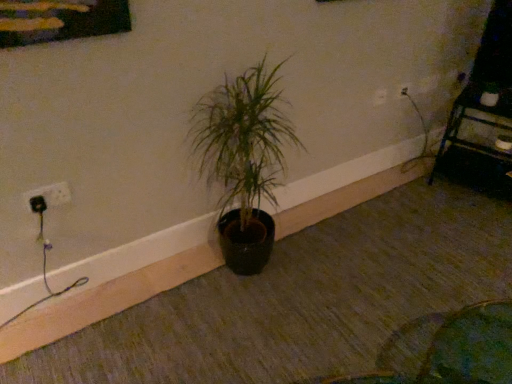
Looking at this image, measure the distance between point (231,143) and camera.

Point (231,143) and camera are 1.71 meters apart.

From the picture: What is the approximate width of green matte plant at center?

green matte plant at center is 37.21 centimeters in width.

This screenshot has height=384, width=512. What are the coordinates of `green matte plant at center` in the screenshot? It's located at (243, 160).

Based on the photo, is white plastic electric outlet at upper right, acting as the second electric outlet starting from the front, turned away from green matte plant at center?

No, white plastic electric outlet at upper right, acting as the second electric outlet starting from the front,'s orientation is not away from green matte plant at center.

How different are the orientations of white plastic electric outlet at upper right, positioned as the 2th electric outlet in left-to-right order, and green matte plant at center in degrees?

The angle between the facing direction of white plastic electric outlet at upper right, positioned as the 2th electric outlet in left-to-right order, and the facing direction of green matte plant at center is 1.09 degrees.

Is green matte plant at center a part of white plastic electric outlet at upper right, which is the 1th electric outlet in top-to-bottom order?

That's incorrect, green matte plant at center is not inside white plastic electric outlet at upper right, which is the 1th electric outlet in top-to-bottom order.

Who is shorter, white plastic electric outlet at upper right, acting as the second electric outlet starting from the front, or green matte plant at center?

Standing shorter between the two is white plastic electric outlet at upper right, acting as the second electric outlet starting from the front.

This screenshot has width=512, height=384. I want to click on electric outlet that appears behind the metallic black shelf at upper right, so click(x=379, y=97).

Is metallic black shelf at upper right located within white plastic electric outlet at upper right, the first electric outlet positioned from the right?

That's incorrect, metallic black shelf at upper right is not inside white plastic electric outlet at upper right, the first electric outlet positioned from the right.

Does point (375, 95) come farther from viewer compared to point (476, 169)?

No, (375, 95) is closer to viewer.

Is metallic black shelf at upper right oriented away from white plastic socket at left, positioned as the 1th electric outlet in front-to-back order?

No, white plastic socket at left, positioned as the 1th electric outlet in front-to-back order, is not at the back of metallic black shelf at upper right.

Does metallic black shelf at upper right have a greater height compared to white plastic socket at left, which is counted as the 1th electric outlet, starting from the left?

Yes.

Find the location of a particular element. The image size is (512, 384). furniture that is above the white plastic socket at left, placed as the second electric outlet when sorted from back to front (from the image's perspective) is located at coordinates (476, 145).

Considering the points (478, 145) and (62, 198), which point is in front, point (478, 145) or point (62, 198)?

The point (62, 198) is closer.

From a real-world perspective, which is physically above, white plastic socket at left, positioned as the 1th electric outlet in front-to-back order, or green matte plant at center?

From a 3D spatial view, white plastic socket at left, positioned as the 1th electric outlet in front-to-back order, is above.

Is white plastic socket at left, acting as the 2th electric outlet starting from the top, bigger than green matte plant at center?

Actually, white plastic socket at left, acting as the 2th electric outlet starting from the top, might be smaller than green matte plant at center.

Does metallic black shelf at upper right have a greater height compared to green matte plant at center?

No, metallic black shelf at upper right is not taller than green matte plant at center.

From a real-world perspective, who is located lower, metallic black shelf at upper right or green matte plant at center?

metallic black shelf at upper right, from a real-world perspective.

Which is nearer, [509,190] or [258,273]?

The point [258,273] is in front.

Is the depth of metallic black shelf at upper right greater than that of green matte plant at center?

Yes, it is.

Find the location of a particular element. The image size is (512, 384). electric outlet that is above the white plastic socket at left, which is counted as the 1th electric outlet, starting from the left (from a real-world perspective) is located at coordinates pos(379,97).

From the image's perspective, is white plastic socket at left, placed as the 1th electric outlet when sorted from bottom to top, positioned above or below white plastic electric outlet at upper right, the first electric outlet positioned from the right?

white plastic socket at left, placed as the 1th electric outlet when sorted from bottom to top, is situated lower than white plastic electric outlet at upper right, the first electric outlet positioned from the right, in the image.

Is white plastic socket at left, positioned as the 1th electric outlet in front-to-back order, not close to white plastic electric outlet at upper right, placed as the 1th electric outlet when sorted from back to front?

white plastic socket at left, positioned as the 1th electric outlet in front-to-back order, is far away from white plastic electric outlet at upper right, placed as the 1th electric outlet when sorted from back to front.

Who is shorter, white plastic socket at left, placed as the second electric outlet when sorted from back to front, or white plastic electric outlet at upper right, which is the 1th electric outlet in top-to-bottom order?

Standing shorter between the two is white plastic socket at left, placed as the second electric outlet when sorted from back to front.

Who is bigger, green matte plant at center or white plastic socket at left, acting as the 2th electric outlet starting from the top?

green matte plant at center is bigger.

In terms of width, does green matte plant at center look wider or thinner when compared to white plastic socket at left, positioned as the 1th electric outlet in front-to-back order?

Considering their sizes, green matte plant at center looks broader than white plastic socket at left, positioned as the 1th electric outlet in front-to-back order.

From a real-world perspective, is green matte plant at center positioned under white plastic socket at left, placed as the 1th electric outlet when sorted from bottom to top, based on gravity?

Correct, in the physical world, green matte plant at center is lower than white plastic socket at left, placed as the 1th electric outlet when sorted from bottom to top.

The height and width of the screenshot is (384, 512). What are the coordinates of `electric outlet that is the 2nd object located behind the green matte plant at center` in the screenshot? It's located at (379, 97).

Where is `electric outlet above the metallic black shelf at upper right (from the image's perspective)`? The height and width of the screenshot is (384, 512). electric outlet above the metallic black shelf at upper right (from the image's perspective) is located at coordinates pyautogui.click(x=379, y=97).

Estimate the real-world distances between objects in this image. Which object is closer to green matte plant at center, white plastic socket at left, which is counted as the 1th electric outlet, starting from the left, or metallic black shelf at upper right?

Among the two, white plastic socket at left, which is counted as the 1th electric outlet, starting from the left, is located nearer to green matte plant at center.

Looking at the image, which one is located closer to metallic black shelf at upper right, white plastic electric outlet at upper right, placed as the 1th electric outlet when sorted from back to front, or white plastic socket at left, acting as the 2th electric outlet starting from the top?

Among the two, white plastic electric outlet at upper right, placed as the 1th electric outlet when sorted from back to front, is located nearer to metallic black shelf at upper right.

From the image, which object appears to be nearer to green matte plant at center, metallic black shelf at upper right or white plastic socket at left, placed as the 2th electric outlet when sorted from right to left?

Based on the image, white plastic socket at left, placed as the 2th electric outlet when sorted from right to left, appears to be nearer to green matte plant at center.

Looking at the image, which one is located further to metallic black shelf at upper right, white plastic socket at left, placed as the 2th electric outlet when sorted from right to left, or green matte plant at center?

Among the two, white plastic socket at left, placed as the 2th electric outlet when sorted from right to left, is located further to metallic black shelf at upper right.

Looking at the image, which one is located further to white plastic electric outlet at upper right, which is the 1th electric outlet in top-to-bottom order, metallic black shelf at upper right or green matte plant at center?

green matte plant at center.

Based on the photo, from the image, which object appears to be farther from white plastic electric outlet at upper right, positioned as the 2th electric outlet in left-to-right order, white plastic socket at left, placed as the 2th electric outlet when sorted from right to left, or green matte plant at center?

Based on the image, white plastic socket at left, placed as the 2th electric outlet when sorted from right to left, appears to be further to white plastic electric outlet at upper right, positioned as the 2th electric outlet in left-to-right order.

When comparing their distances from green matte plant at center, does white plastic electric outlet at upper right, acting as the second electric outlet starting from the front, or metallic black shelf at upper right seem closer?

white plastic electric outlet at upper right, acting as the second electric outlet starting from the front.

From the image, which object appears to be farther from white plastic socket at left, placed as the second electric outlet when sorted from back to front, white plastic electric outlet at upper right, the first electric outlet positioned from the right, or green matte plant at center?

Based on the image, white plastic electric outlet at upper right, the first electric outlet positioned from the right, appears to be further to white plastic socket at left, placed as the second electric outlet when sorted from back to front.

Identify the location of houseplant between white plastic socket at left, acting as the 2th electric outlet starting from the top, and white plastic electric outlet at upper right, positioned as the 2th electric outlet in left-to-right order. (243, 160).

Find the location of a particular element. The width and height of the screenshot is (512, 384). electric outlet between green matte plant at center and metallic black shelf at upper right from left to right is located at coordinates point(379,97).

What are the coordinates of `houseplant located between white plastic socket at left, placed as the 1th electric outlet when sorted from bottom to top, and metallic black shelf at upper right in the left-right direction` in the screenshot? It's located at (243, 160).

The width and height of the screenshot is (512, 384). Identify the location of electric outlet situated between white plastic socket at left, which is counted as the 1th electric outlet, starting from the left, and metallic black shelf at upper right from left to right. (379, 97).